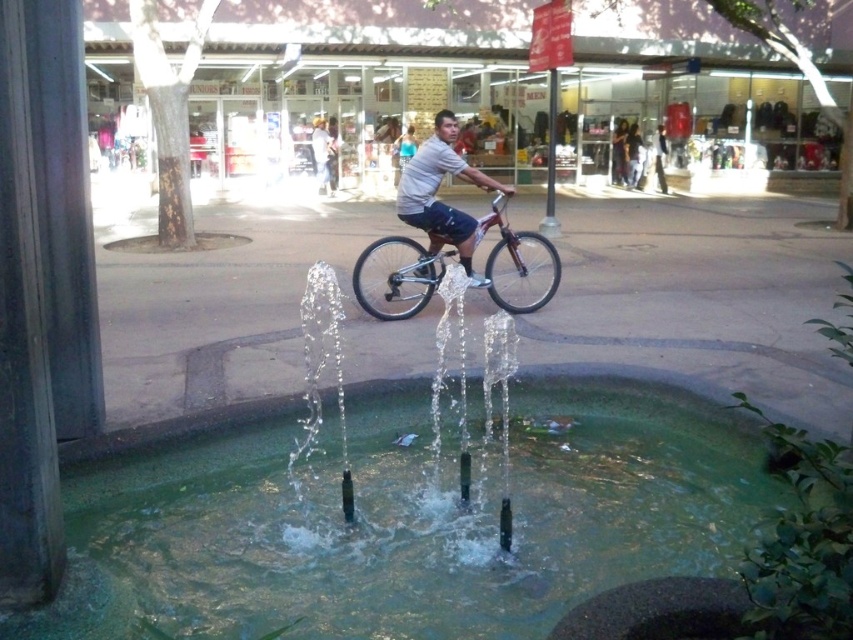
You are a pedestrian standing on the sidewalk and see the shiny metallic bicycle at center and the white matte shirt at center. Which object is closer to the ground?

The shiny metallic bicycle at center is closer to the ground because it is positioned below the white matte shirt at center.

You are a delivery person who needs to cross the street to reach the shops in the background. The clear water at center is in your path. Can you safely walk around the shiny metallic bicycle at center to avoid stepping into the water?

The clear water at center is 2.54 meters away from the shiny metallic bicycle at center. Since the distance between them allows enough space to maneuver around the bicycle, you can safely walk around the shiny metallic bicycle at center to avoid the water.

You are a pedestrian standing on the sidewalk and want to cross the street to reach a store. You see the shiny metallic bicycle at center and the white matte shirt at center. Which object is closer to you?

The shiny metallic bicycle at center is closer to you because it is further to the viewer than the white matte shirt at center.